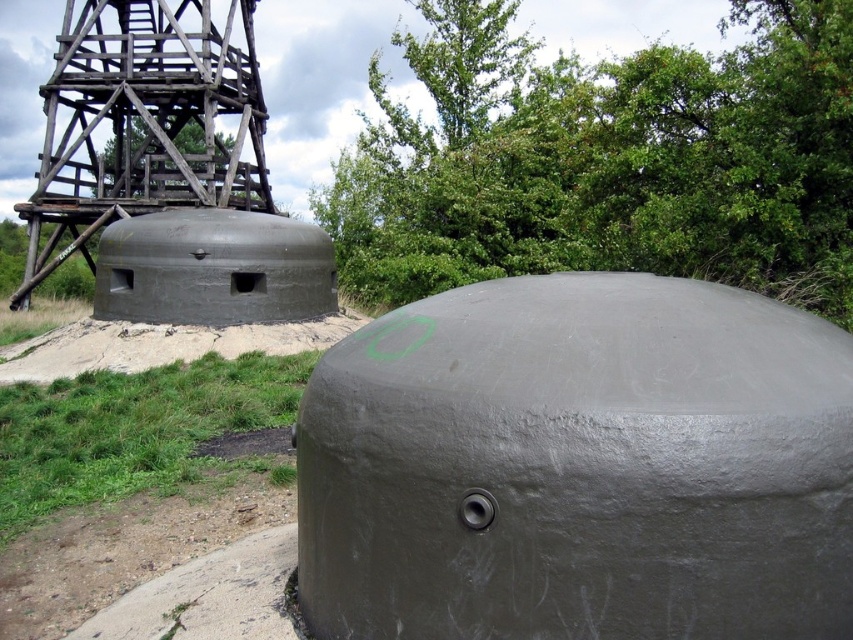
You are a maintenance worker needing to inspect both the gray concrete dome at center and the gray concrete turret at center. Your tool kit can only carry enough supplies for a 20 meter round trip. Starting from the dome, can you reach the turret and return without needing more supplies?

The distance between the gray concrete dome at center and the gray concrete turret at center is 19.94 meters. Since the round trip would be 39.88 meters, which exceeds the 20 meter limit, you cannot complete the inspection without additional supplies.

You are standing in front of the two bunkers and want to determine which point is nearer to you. The points are labeled as point [820,605] and point [239,589]. Which point is closer to your current position?

Point [820,605] is closer to the viewer than point [239,589].